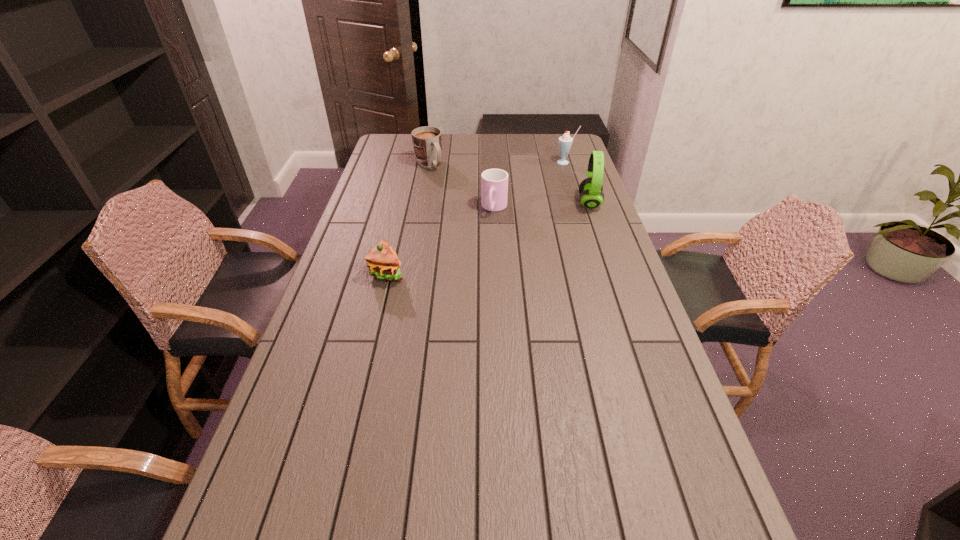
Image resolution: width=960 pixels, height=540 pixels. Identify the location of free spot on the desktop that is between the sandwich and the headset and is positioned with the handle on the side of the cup. (483, 239).

In order to click on vacant space on the desktop that is between the nearest object and the headset and is positioned on the straw side of the milkshake in this screenshot , I will do `click(509, 231)`.

Locate an element on the screen. free space on the desktop that is between the sandwich and the tallest object and is positioned on the side of the mug with the handle is located at coordinates (501, 233).